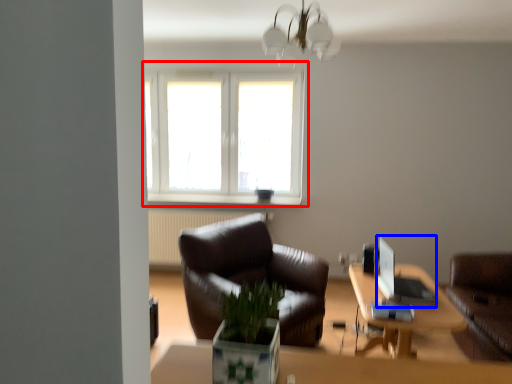
Question: Among these objects, which one is farthest to the camera, window (highlighted by a red box) or computer (highlighted by a blue box)?

Choices:
 (A) window
 (B) computer

Answer: (A)